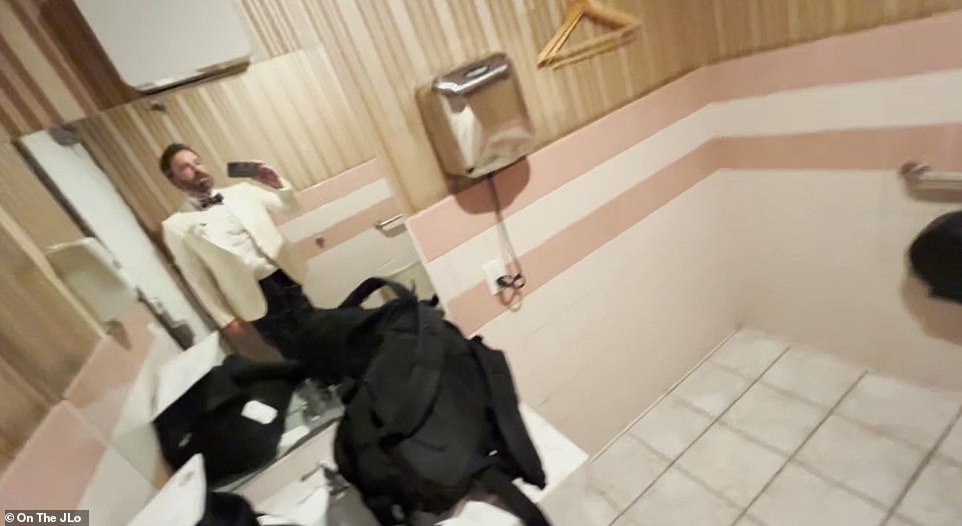
The image size is (962, 526). Identify the location of plug. (513, 300).